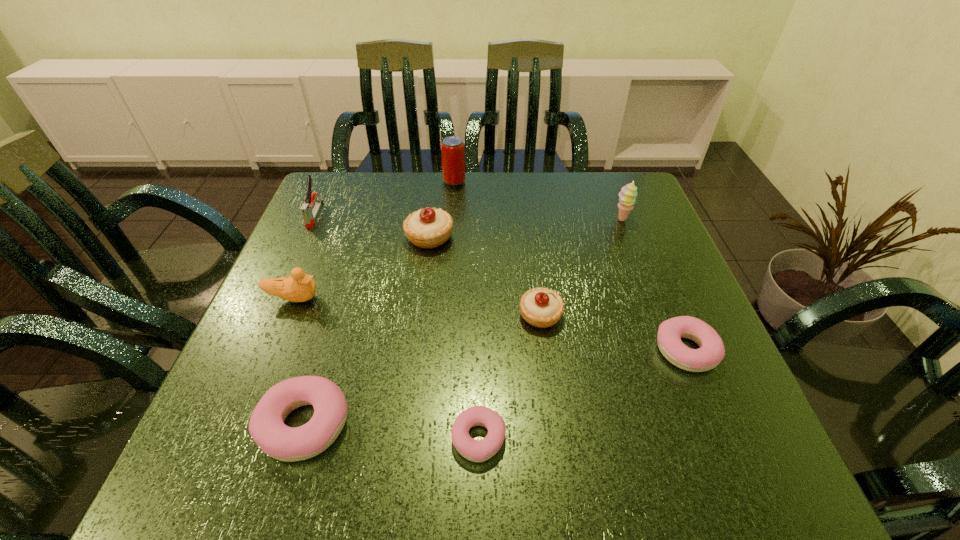
This screenshot has width=960, height=540. What are the coordinates of `vacant position in the image that satisfies the following two spatial constraints: 1. on the back side of the fourth shortest object; 2. on the left side of the seventh tallest object` in the screenshot? It's located at (338, 315).

What are the coordinates of `vacant position in the image that satisfies the following two spatial constraints: 1. on the back side of the right beige pastry; 2. on the face of the duckling` in the screenshot? It's located at (539, 299).

Find the location of a particular element. free point that satisfies the following two spatial constraints: 1. on the face of the duckling; 2. on the left side of the second pink pastry from left to right is located at coordinates (235, 438).